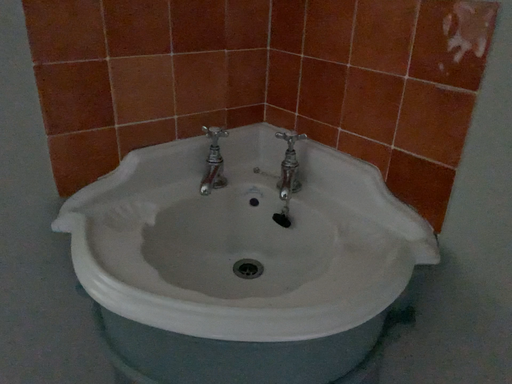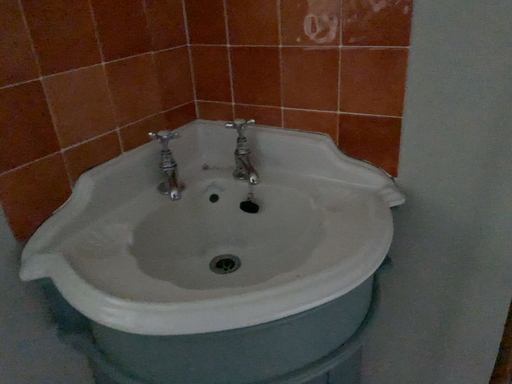
Question: How did the camera likely rotate when shooting the video?

Choices:
 (A) rotated left
 (B) rotated right

Answer: (B)